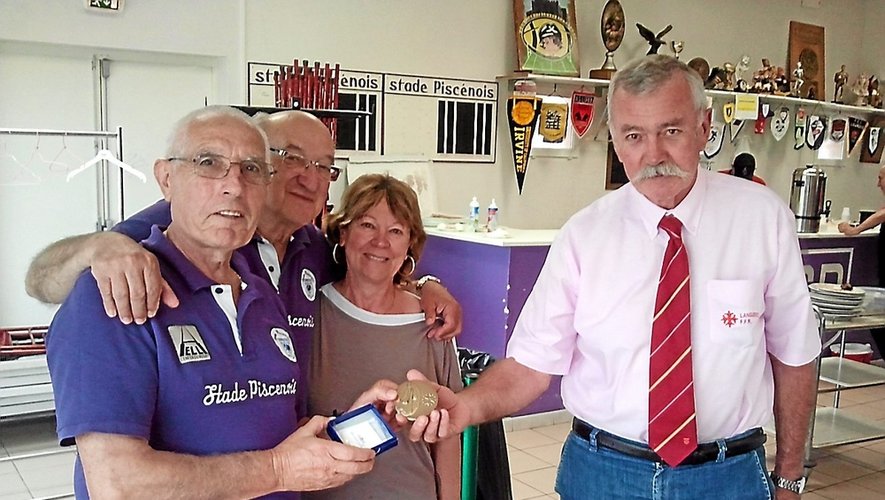
Identify the location of floor. The height and width of the screenshot is (500, 885). (59, 482), (537, 458), (856, 470).